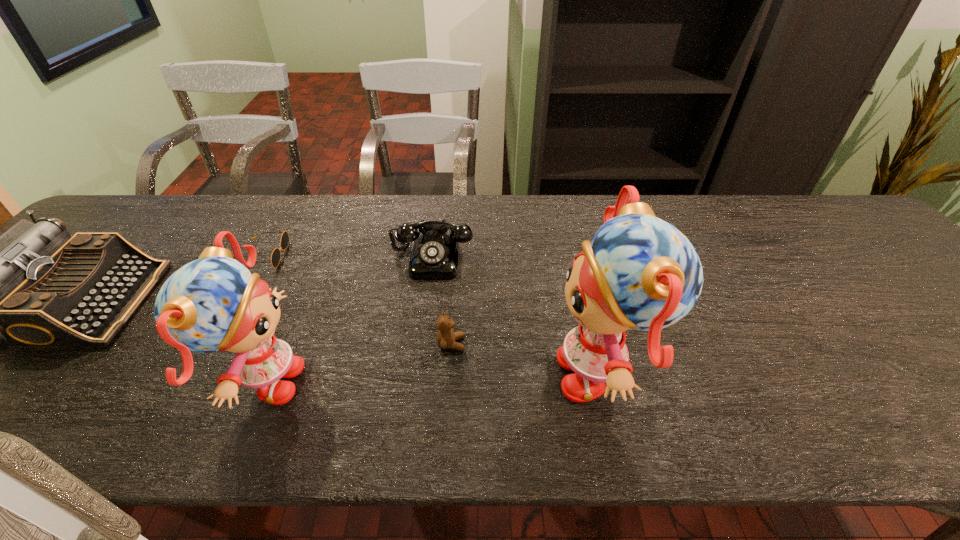
Image resolution: width=960 pixels, height=540 pixels. Find the location of `vacant point located between the shortest object and the telephone`. vacant point located between the shortest object and the telephone is located at coordinates (348, 256).

This screenshot has height=540, width=960. What are the coordinates of `vacant region between the teddy bear and the telephone` in the screenshot? It's located at (442, 301).

Find the location of `vacant region between the telephone and the right doll`. vacant region between the telephone and the right doll is located at coordinates (517, 315).

Where is `unoccupied area between the teddy bear and the rightmost object`? The image size is (960, 540). unoccupied area between the teddy bear and the rightmost object is located at coordinates (527, 359).

You are a GUI agent. You are given a task and a screenshot of the screen. Output one action in this format:
    pyautogui.click(x=<x>, y=<y>)
    Task: Click on the vacant space in between the telephone and the teddy bear
    This screenshot has width=960, height=540.
    Given the screenshot: What is the action you would take?
    pyautogui.click(x=442, y=301)

Image resolution: width=960 pixels, height=540 pixels. I want to click on free spot between the teddy bear and the telephone, so click(x=442, y=301).

Identify which object is the nearest to the telephone. Please provide its 2D coordinates. Your answer should be formatted as a tuple, i.e. [(x, y)], where the tuple contains the x and y coordinates of a point satisfying the conditions above.

[(446, 337)]

Choose which object is the second nearest neighbor to the sunglasses. Please provide its 2D coordinates. Your answer should be formatted as a tuple, i.e. [(x, y)], where the tuple contains the x and y coordinates of a point satisfying the conditions above.

[(214, 303)]